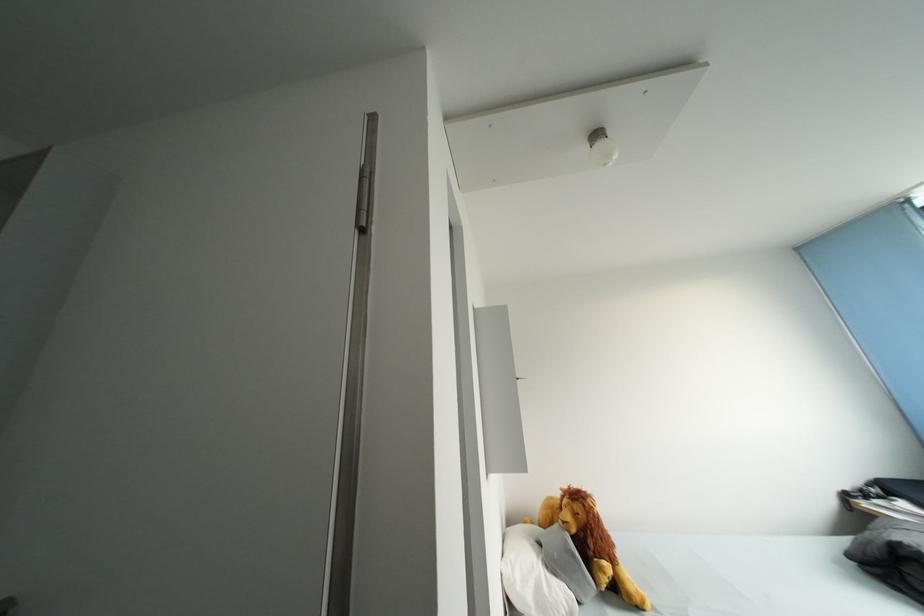
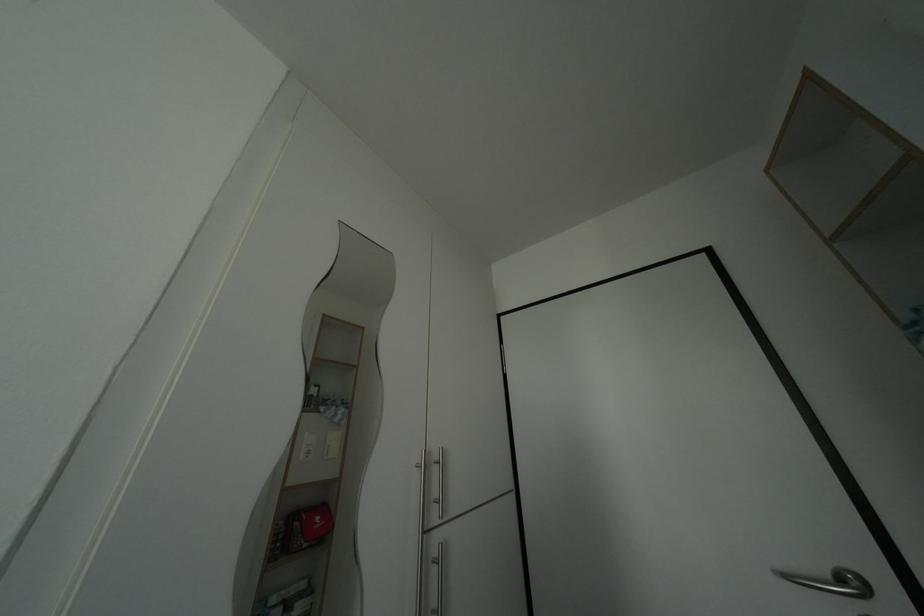
Based on the continuous images, in which direction is the camera rotating?

The camera rotated toward left-up.